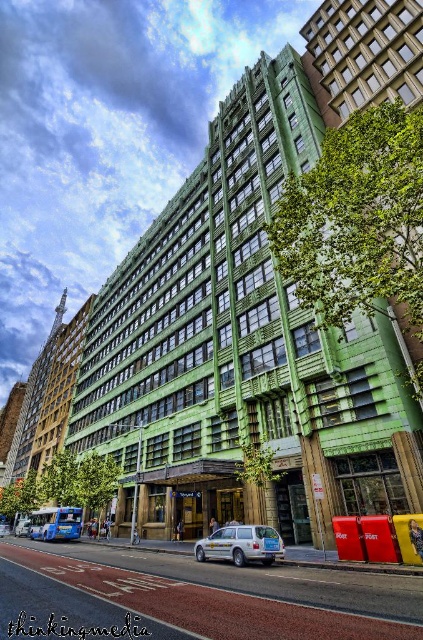
You are a delivery person trying to park your van between the white plastic car at center and the matte silver station wagon at center. Which vehicle should you move to make space?

The white plastic car at center is larger than the matte silver station wagon at center, so you should move the white plastic car at center to create more space for your van.

You are a pedestrian standing at the edge of the street. You see a white plastic car at center and a matte silver station wagon at center. Which car is closer to you?

The white plastic car at center is closer to you because it is in front of the matte silver station wagon at center.